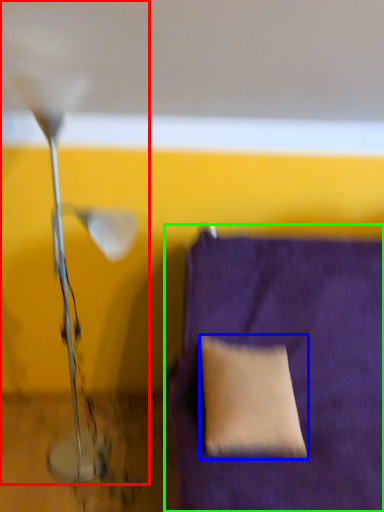
Question: Considering the real-world distances, which object is farthest from lamp (highlighted by a red box)? pillow (highlighted by a blue box) or furniture (highlighted by a green box)?

Choices:
 (A) pillow
 (B) furniture

Answer: (B)